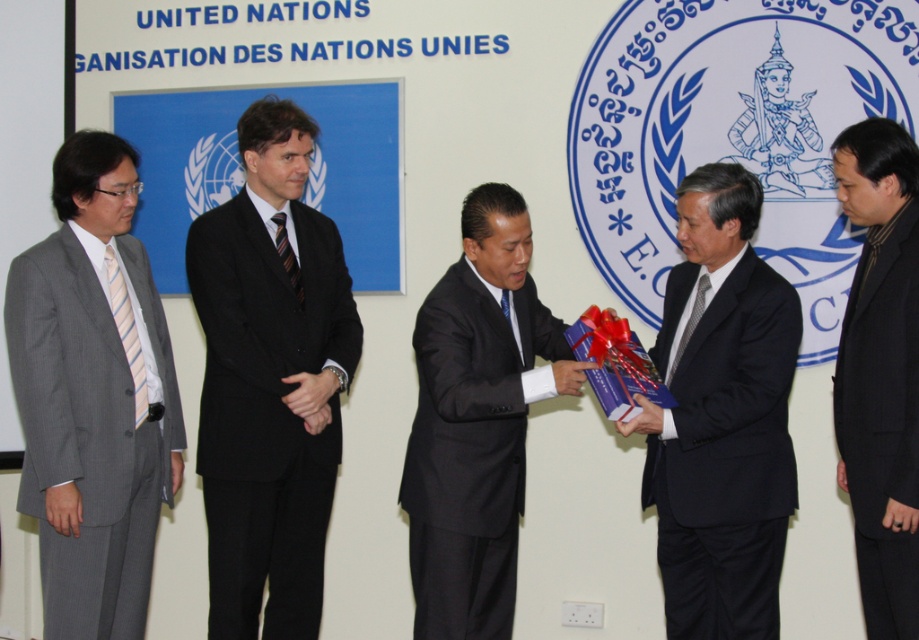
Is black pinstripe suit at center positioned at the back of matte black suit at center?

Yes.

Identify the location of black pinstripe suit at center. The height and width of the screenshot is (640, 919). (269, 381).

Is black matte suit at center positioned at the back of black matte suit at right?

That is True.

Is black matte suit at center to the right of black matte suit at right from the viewer's perspective?

In fact, black matte suit at center is to the left of black matte suit at right.

This screenshot has height=640, width=919. I want to click on black matte suit at center, so click(721, 417).

Between striped fabric tie at left and striped fabric tie at center, which one is positioned higher?

striped fabric tie at center is above.

Does striped fabric tie at left appear over striped fabric tie at center?

No.

Is point (115, 294) positioned after point (293, 291)?

No.

This screenshot has width=919, height=640. In order to click on striped fabric tie at left in this screenshot , I will do `click(127, 332)`.